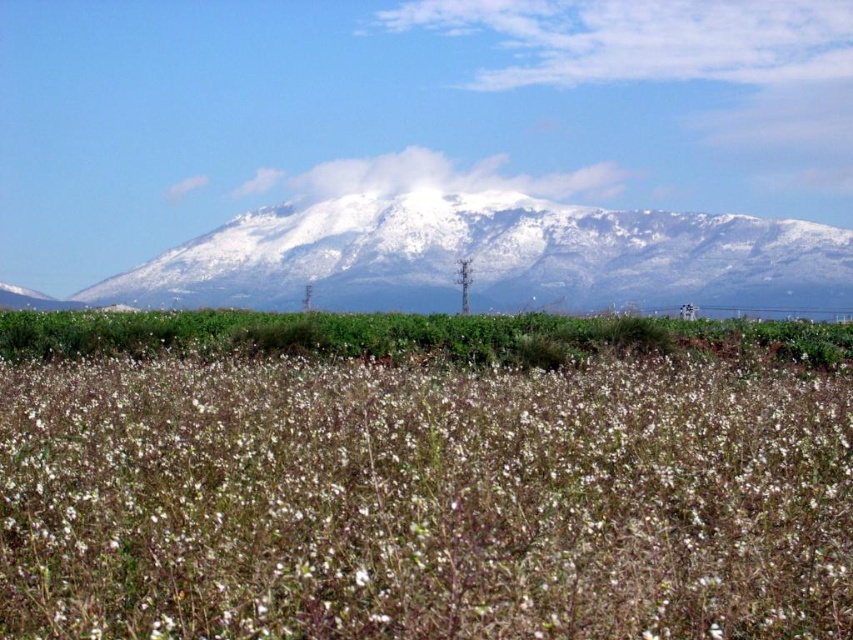
Is white snow-covered mountain at center thinner than green leafy grass at center?

In fact, white snow-covered mountain at center might be wider than green leafy grass at center.

From the picture: Which of these two, white snow-covered mountain at center or green leafy grass at center, stands taller?

Standing taller between the two is white snow-covered mountain at center.

Is point (450, 298) farther from camera compared to point (672, 337)?

Yes, it is.

Where is `white snow-covered mountain at center`? Image resolution: width=853 pixels, height=640 pixels. white snow-covered mountain at center is located at coordinates (492, 257).

Who is lower down, white fluffy plant at center or green leafy grass at center?

white fluffy plant at center is below.

Does point (260, 444) come in front of point (820, 360)?

Yes, it is.

The height and width of the screenshot is (640, 853). Describe the element at coordinates (422, 500) in the screenshot. I see `white fluffy plant at center` at that location.

Find the location of a particular element. The width and height of the screenshot is (853, 640). white fluffy plant at center is located at coordinates (422, 500).

Measure the distance between white fluffy plant at center and white snow-covered mountain at center.

A distance of 45.78 meters exists between white fluffy plant at center and white snow-covered mountain at center.

Is point (697, 371) closer to camera compared to point (195, 241)?

Yes, it is.

Image resolution: width=853 pixels, height=640 pixels. I want to click on white fluffy plant at center, so click(x=422, y=500).